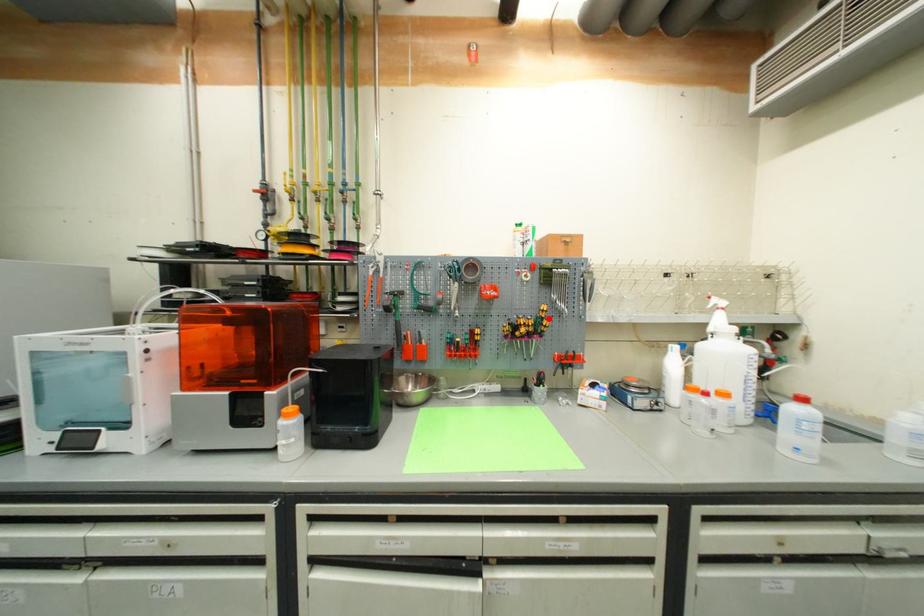
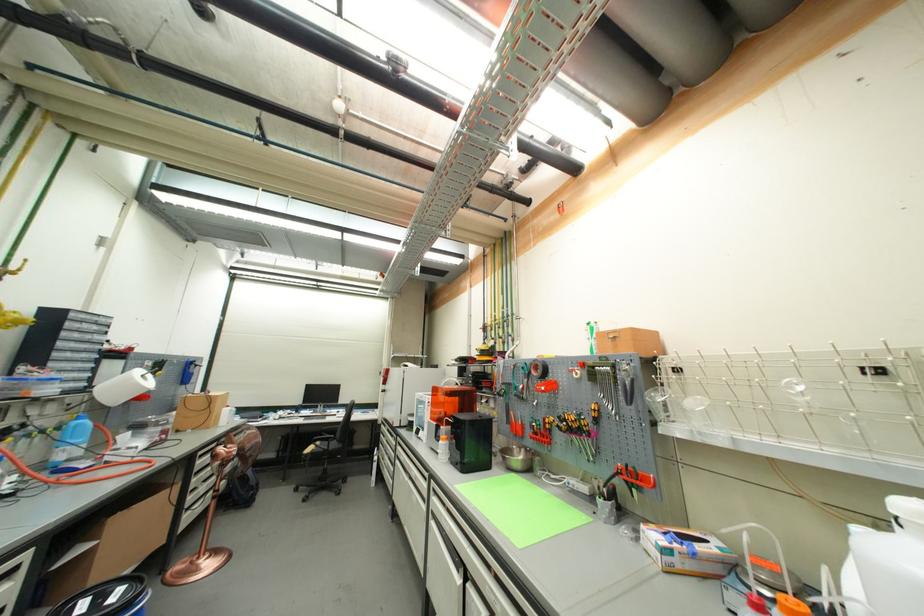
Find the pixel in the second image that matches the highlighted location in the first image.

(602, 418)